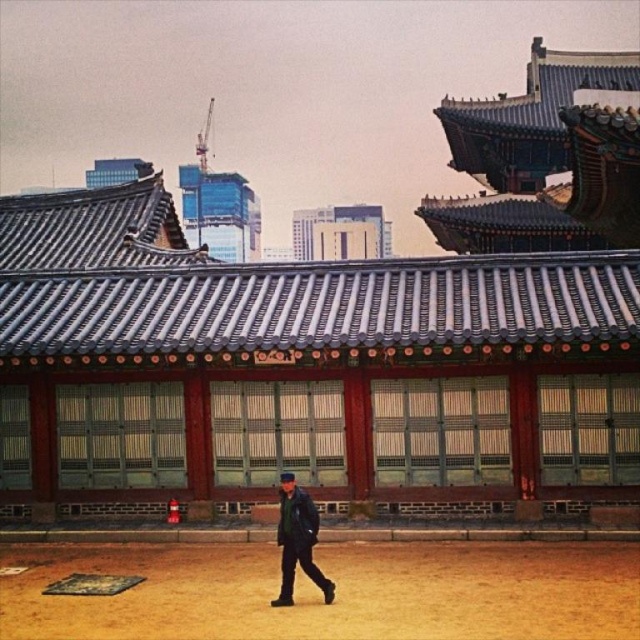
Question: Can you confirm if dark blue leather jacket at lower center is wider than white concrete building at center?

Choices:
 (A) no
 (B) yes

Answer: (A)

Question: Which object is the farthest from the dark blue leather jacket at lower center?

Choices:
 (A) white concrete building at center
 (B) brown sandy ground at center

Answer: (A)

Question: Does brown sandy ground at center appear over dark blue leather jacket at lower center?

Choices:
 (A) no
 (B) yes

Answer: (A)

Question: Is brown sandy ground at center positioned behind dark blue leather jacket at lower center?

Choices:
 (A) yes
 (B) no

Answer: (A)

Question: Among these points, which one is nearest to the camera?

Choices:
 (A) (288, 483)
 (B) (500, 576)
 (C) (324, 209)

Answer: (A)

Question: Estimate the real-world distances between objects in this image. Which object is farther from the dark blue leather jacket at lower center?

Choices:
 (A) white concrete building at center
 (B) brown sandy ground at center

Answer: (A)